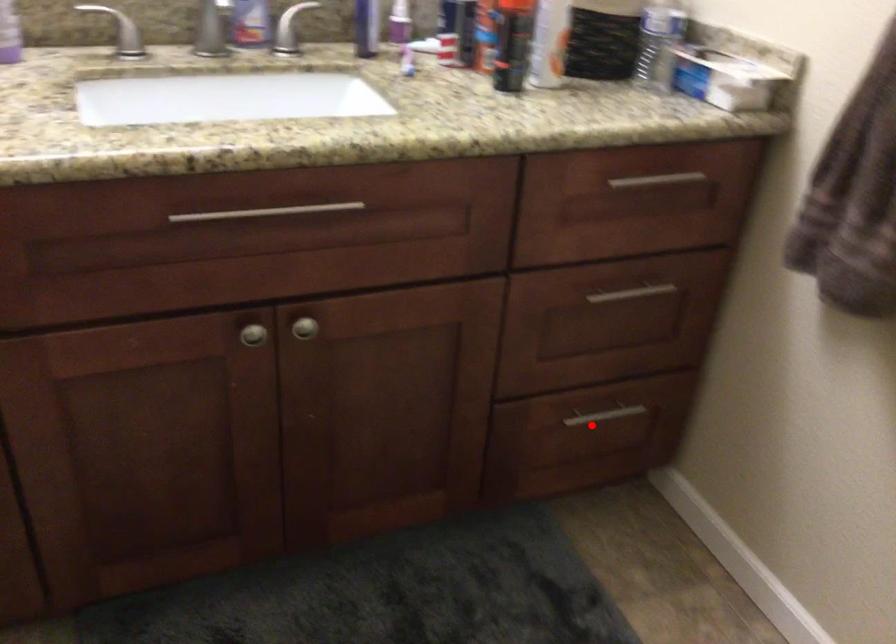
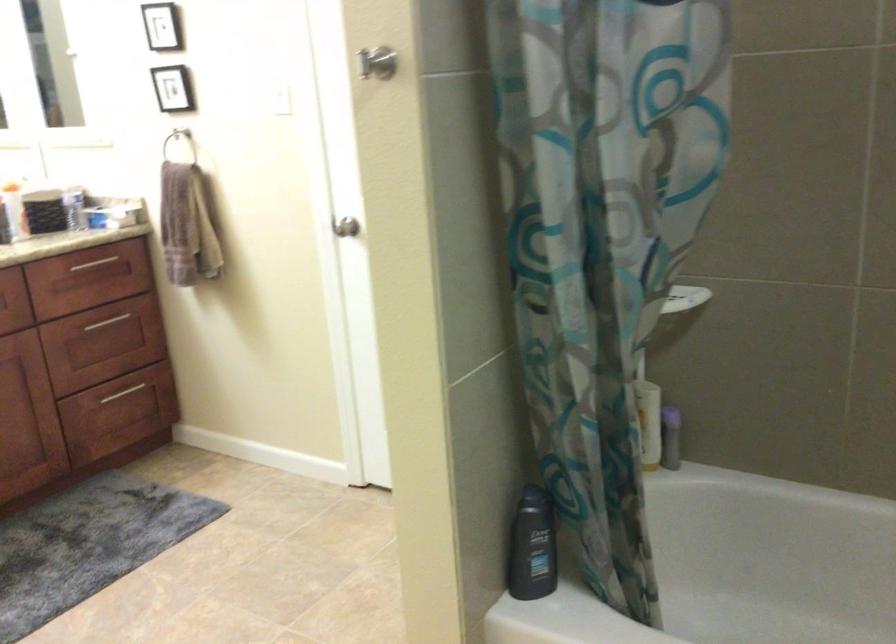
Where in the second image is the point corresponding to the highlighted location from the first image?

(122, 393)